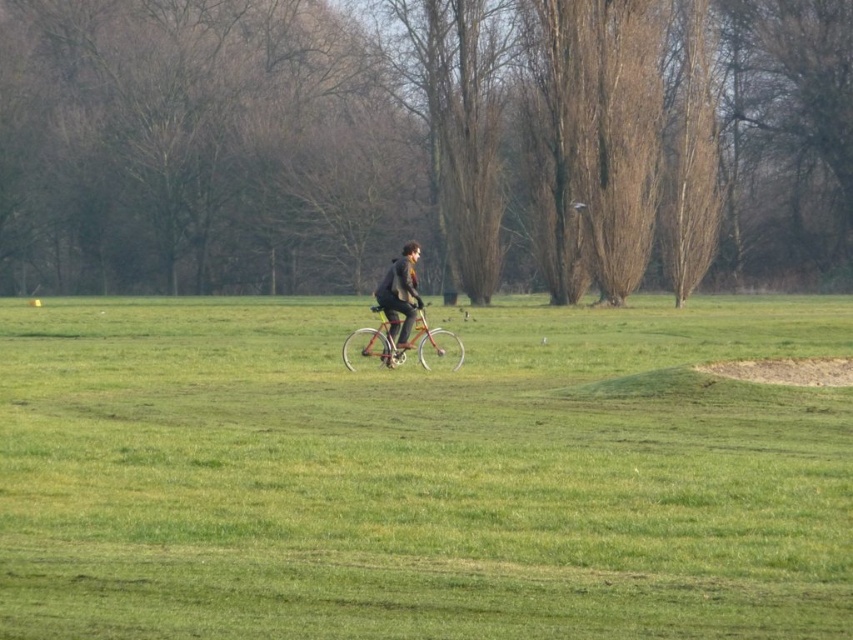
You are standing at the origin point of the coordinate system, which is at the bottom left corner of the image. The image has a coordinate system where the x and y axes range from 0 to 1. You want to locate the metallic silver bicycle at center. What are its coordinates?

The metallic silver bicycle at center is located at coordinates x 0.539 and y 0.438.

Based on the photo, you are standing at the edge of the field looking towards the center. There is a point marked at coordinates (x=421, y=474). What is located at that point?

The point at coordinates (x=421, y=474) marks green grass at center.